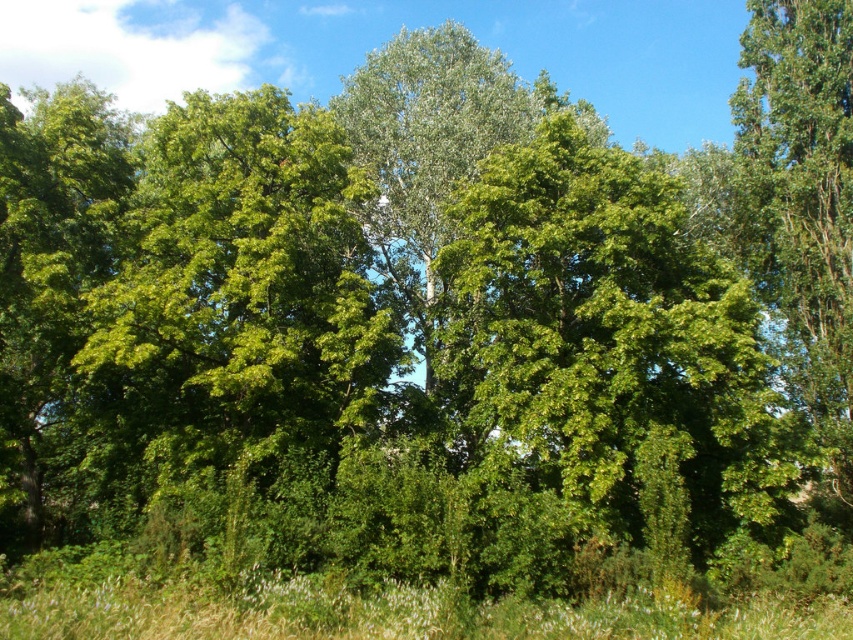
You are a hiker standing in the forest and want to find a spot to set up your tent. Which object should you choose between the green grassy at lower center and the green leafy tree at right if you want to be closer to the tree?

The green grassy at lower center is located below green leafy tree at right, so if you want to be closer to the tree, you should choose the green grassy at lower center as it is positioned directly beneath the tree.

You are a hiker who wants to take a photo of the green leafy tree at center and the green grassy at lower center. Which object should you focus on first if you want to capture both in a single frame without moving the camera?

You should focus on the green leafy tree at center first because it is larger in size compared to the green grassy at lower center, ensuring it is in focus while the grassy area remains within the depth of field.

You are standing in the forest and want to walk towards the green grassy at lower center. Which direction should you move relative to the green leafy tree at center?

Since the green leafy tree at center is to the right of the green grassy at lower center, you should move to the left relative to the green leafy tree at center to reach the green grassy at lower center.